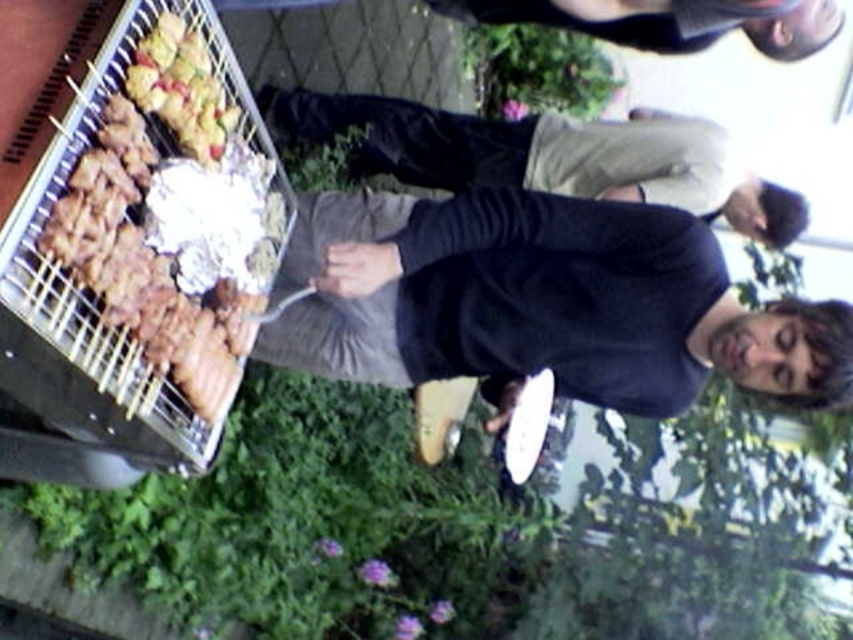
You are trying to place a new decorative item on the dark gray sweater at center. According to the image, where exactly should you position it?

The dark gray sweater at center is located at point (521, 298), so you should position the decorative item at those coordinates.

You are standing at the position of the person holding the white plate. You want to move to the point labeled point (675, 236). Is this point behind or in front of the point labeled point (724, 33)?

Point (675, 236) is behind point (724, 33).

You are standing in front of the barbecue grill and want to grab the plate from the person holding it. Which point, point (793, 12) or point (216, 164), is closer to you?

Point (793, 12) is further to the camera than point (216, 164), so the closer point to you is point (216, 164).